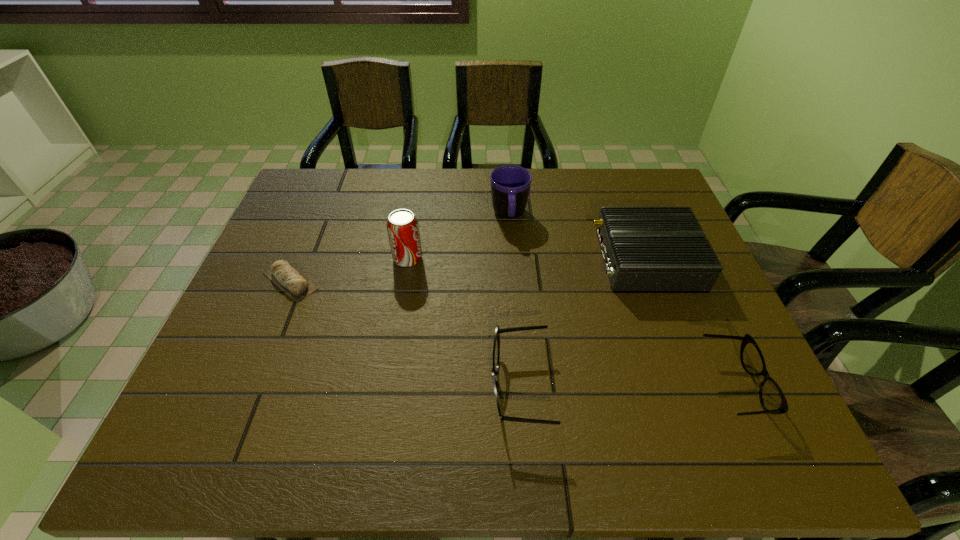
Find the location of `spectacles present at the right edge`. spectacles present at the right edge is located at coordinates tap(772, 399).

I want to click on router situated at the right edge, so click(x=645, y=249).

Where is `object situated at the near right corner`? object situated at the near right corner is located at coordinates (772, 399).

Locate an element on the screen. The image size is (960, 540). free spot at the far edge of the desktop is located at coordinates (563, 188).

The height and width of the screenshot is (540, 960). I want to click on vacant space at the near edge, so click(x=678, y=381).

You are a GUI agent. You are given a task and a screenshot of the screen. Output one action in this format:
    pyautogui.click(x=<x>, y=<y>)
    Task: Click on the vacant space at the left edge of the desktop
    
    Given the screenshot: What is the action you would take?
    pyautogui.click(x=308, y=237)

Identify the location of vacant region at the far left corner. The image size is (960, 540). (348, 178).

In the image, there is a desktop. In order to click on vacant region at the near left corner in this screenshot , I will do 239,408.

This screenshot has height=540, width=960. In the image, there is a desktop. Find the location of `vacant space at the far right corner`. vacant space at the far right corner is located at coordinates (652, 189).

Identify the location of free spot between the third shortest object and the pita bread. The height and width of the screenshot is (540, 960). (405, 334).